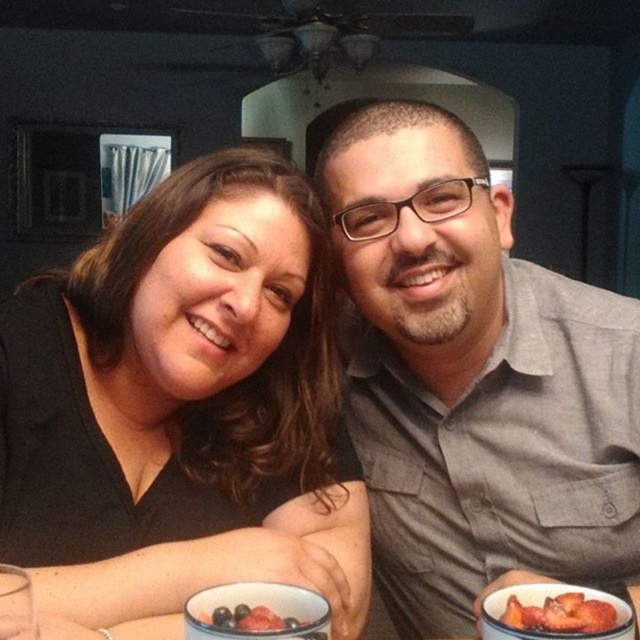
Is gray cotton shirt at center thinner than smooth red strawberries at lower right?

No.

In the scene shown: Is the position of gray cotton shirt at center more distant than that of smooth red strawberries at lower right?

Yes, it is behind smooth red strawberries at lower right.

You are a GUI agent. You are given a task and a screenshot of the screen. Output one action in this format:
    pyautogui.click(x=<x>, y=<y>)
    Task: Click on the gray cotton shirt at center
    This screenshot has width=640, height=640.
    Given the screenshot: What is the action you would take?
    pyautogui.click(x=474, y=378)

Does black matte shirt at center have a greater height compared to blueberry matte at lower center?

Yes.

Which of these two, black matte shirt at center or blueberry matte at lower center, stands shorter?

blueberry matte at lower center

Where is `black matte shirt at center`? This screenshot has height=640, width=640. black matte shirt at center is located at coordinates (182, 406).

Can you confirm if black matte shirt at center is shorter than gray cotton shirt at center?

Correct, black matte shirt at center is not as tall as gray cotton shirt at center.

Who is positioned more to the right, black matte shirt at center or gray cotton shirt at center?

From the viewer's perspective, gray cotton shirt at center appears more on the right side.

Which is behind, point (173, 278) or point (467, 582)?

Positioned behind is point (467, 582).

The width and height of the screenshot is (640, 640). I want to click on black matte shirt at center, so click(182, 406).